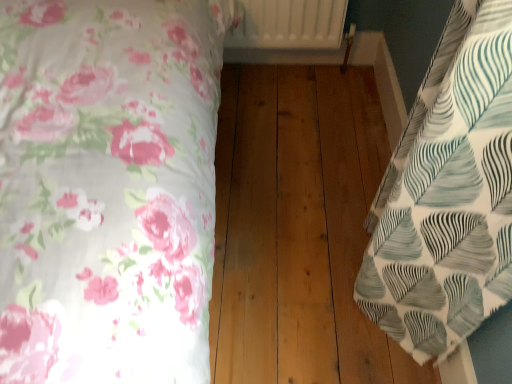
Question: Looking at their shapes, would you say white textured fabric at right, the second bed when ordered from left to right, is wider or thinner than white floral fabric at left, which appears as the 2th bed when viewed from the right?

Choices:
 (A) thin
 (B) wide

Answer: (A)

Question: Is point (461, 284) closer or farther from the camera than point (187, 339)?

Choices:
 (A) closer
 (B) farther

Answer: (B)

Question: Estimate the real-world distances between objects in this image. Which object is farther from the white matte radiator at upper center?

Choices:
 (A) natural wood floor at center
 (B) white textured fabric at right, which is counted as the first bed, starting from the right
 (C) white floral fabric at left, acting as the first bed starting from the left

Answer: (B)

Question: Considering the real-world distances, which object is farthest from the natural wood floor at center?

Choices:
 (A) white floral fabric at left, which appears as the 2th bed when viewed from the right
 (B) white textured fabric at right, the second bed when ordered from left to right
 (C) white matte radiator at upper center

Answer: (A)